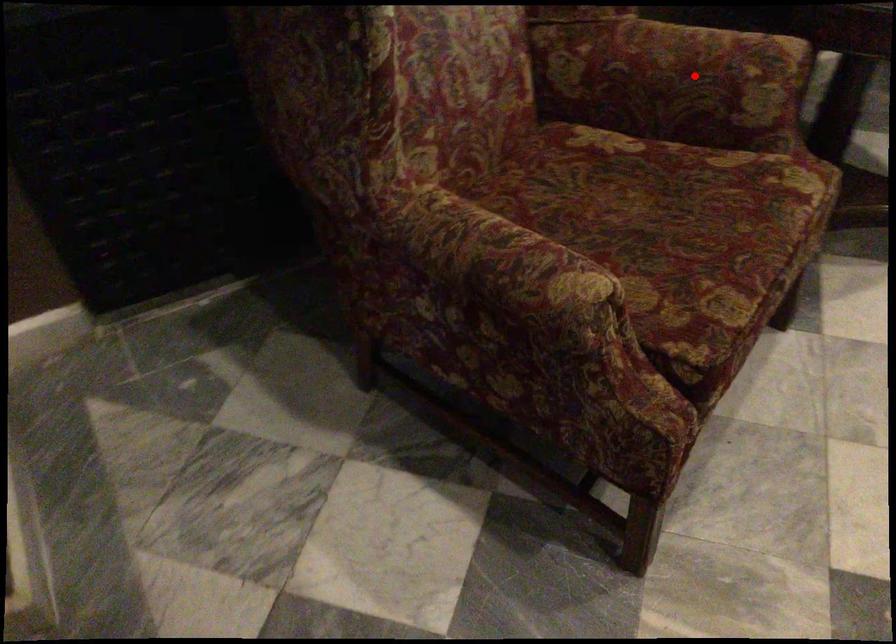
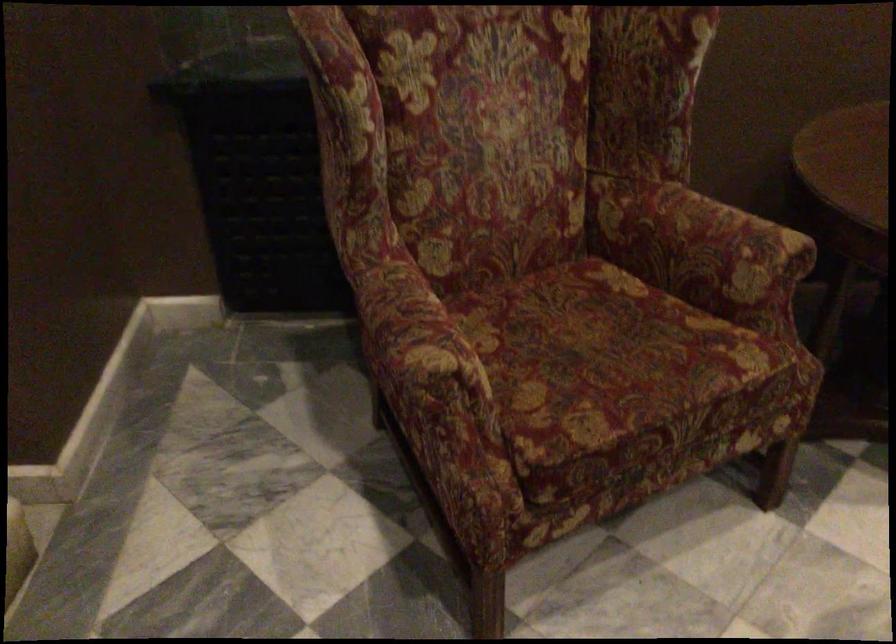
Question: I am providing you with two images of the same scene from different viewpoints. A red point is shown in image1. For the corresponding object point in image2, is it positioned nearer or farther from the camera?

Choices:
 (A) Nearer
 (B) Farther

Answer: (B)